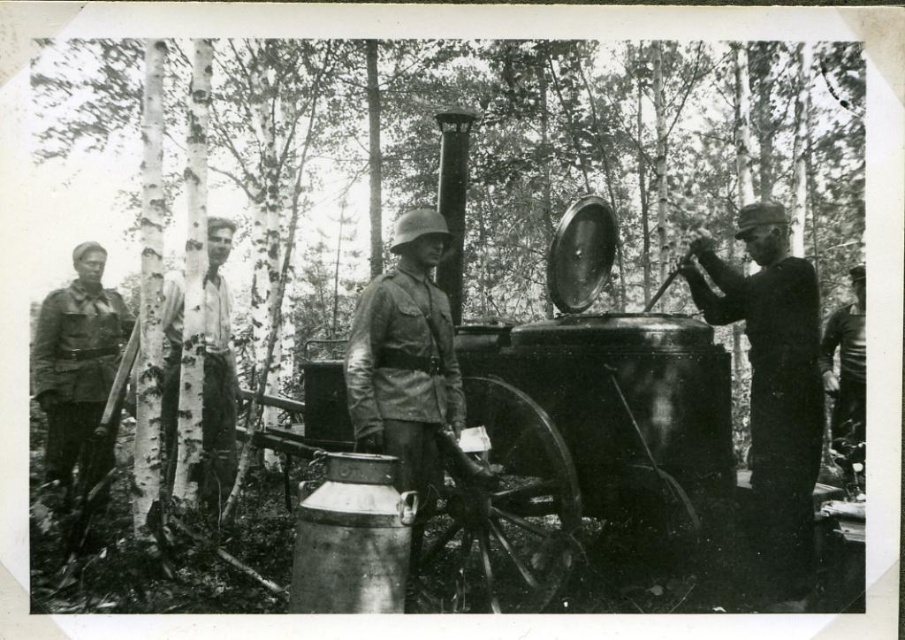
In the image of the historical steam device in the woods, where exactly is the camouflage fabric uniform at center located in terms of coordinates?

The camouflage fabric uniform at center is located at coordinates point (403,376).